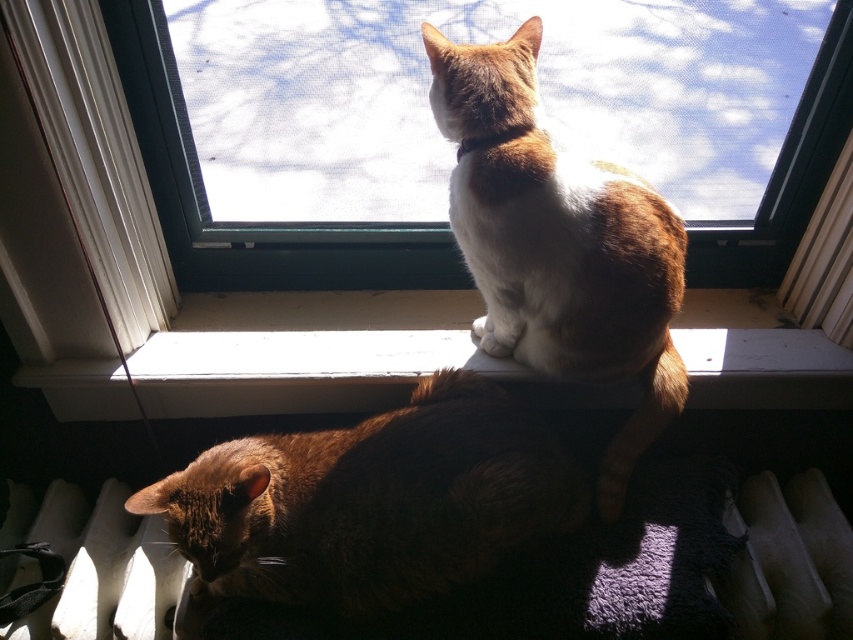
You are a small toy mouse that wants to jump from the transparent glass window at upper center to the white soft fur cat at upper center. Can you make the jump without falling?

The transparent glass window at upper center is shorter in height than the white soft fur cat at upper center, so the mouse would need to jump upward to reach the cat, which might be difficult without additional support.

You are trying to determine if the transparent glass window at upper center can fully cover the dark brown fur cat at lower center when viewed from the outside. Based on their heights, is this possible?

The transparent glass window at upper center is taller than the dark brown fur cat at lower center, so it can fully cover the dark brown fur cat at lower center when viewed from the outside.